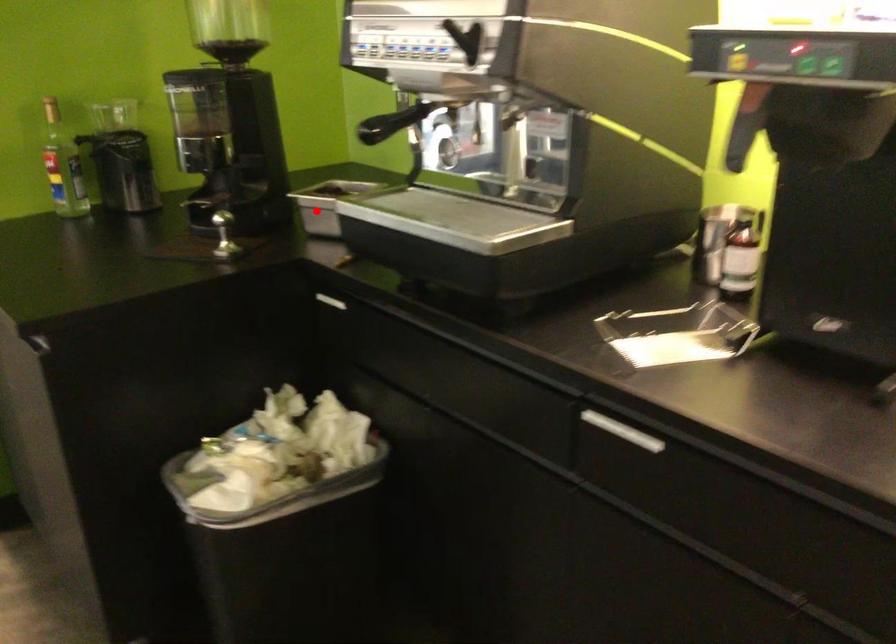
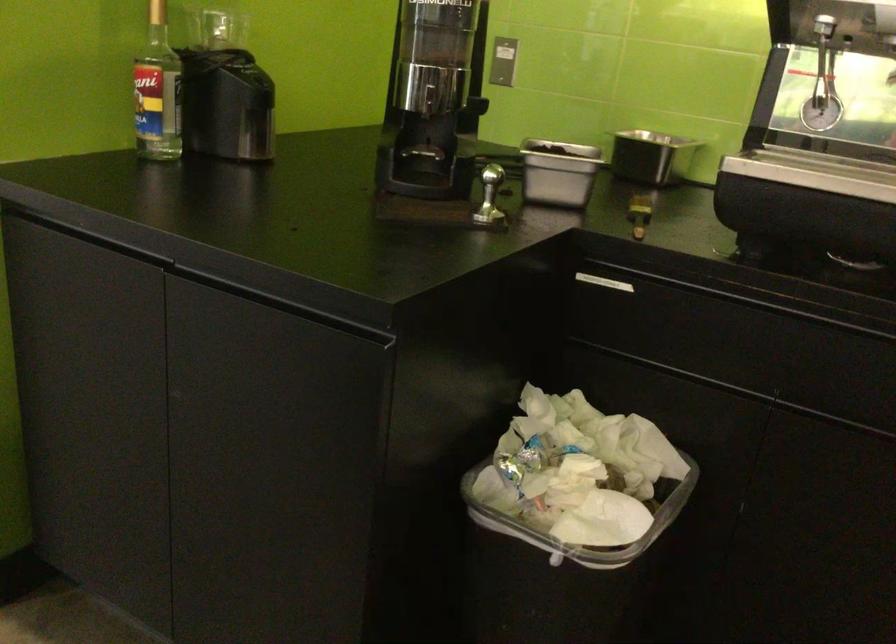
Question: I am providing you with two images of the same scene from different viewpoints. Given a red point in image1, look at the same physical point in image2. Is it:

Choices:
 (A) Closer to the viewpoint
 (B) Farther from the viewpoint

Answer: (A)